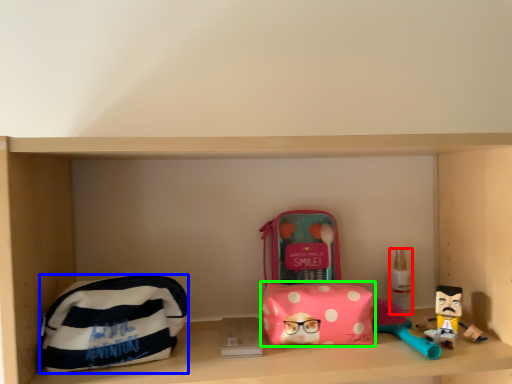
Question: Which object is the closest to the toiletry (highlighted by a red box)? Choose among these: pouch (highlighted by a blue box) or pouch (highlighted by a green box).

Choices:
 (A) pouch
 (B) pouch

Answer: (B)